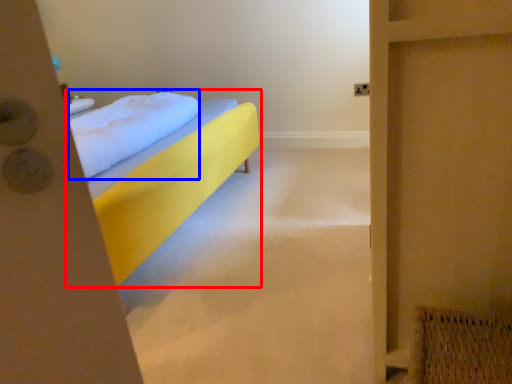
Question: Which of the following is the farthest to the observer, bed (highlighted by a red box) or pillow (highlighted by a blue box)?

Choices:
 (A) bed
 (B) pillow

Answer: (B)